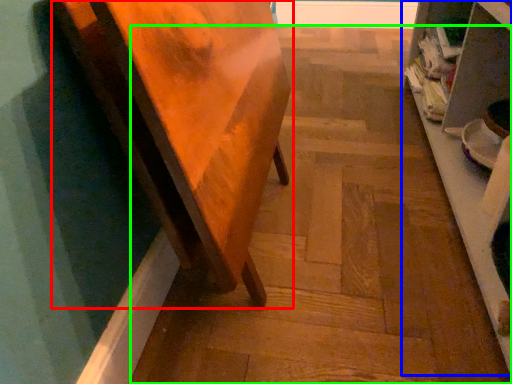
Question: Estimate the real-world distances between objects in this image. Which object is closer to furniture (highlighted by a red box), shelf (highlighted by a blue box) or stair (highlighted by a green box)?

Choices:
 (A) shelf
 (B) stair

Answer: (B)